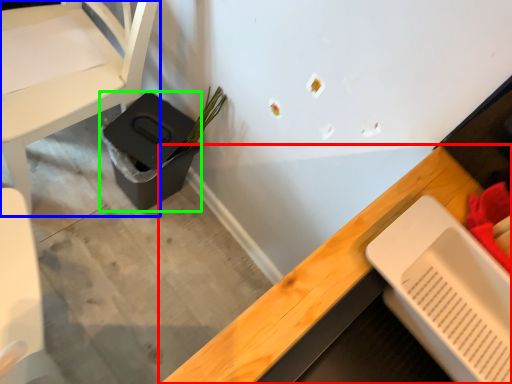
Question: Estimate the real-world distances between objects in this image. Which object is closer to desk (highlighted by a red box), chair (highlighted by a blue box) or potty (highlighted by a green box)?

Choices:
 (A) chair
 (B) potty

Answer: (B)